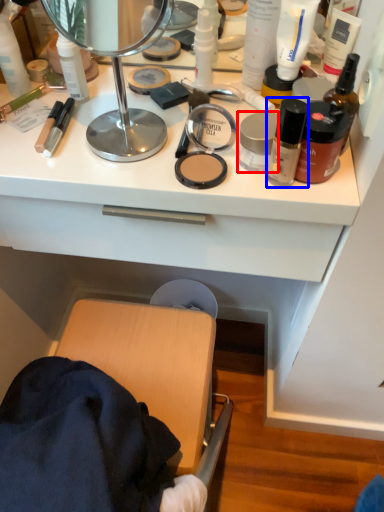
Question: Which of the following is the farthest to the observer, toiletry (highlighted by a red box) or toiletry (highlighted by a blue box)?

Choices:
 (A) toiletry
 (B) toiletry

Answer: (A)